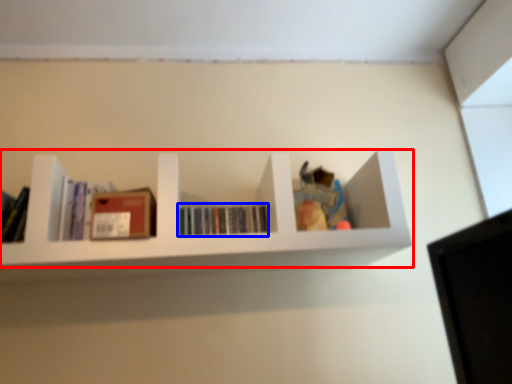
Question: Which of the following is the closest to the observer, shelf (highlighted by a red box) or book (highlighted by a blue box)?

Choices:
 (A) shelf
 (B) book

Answer: (A)